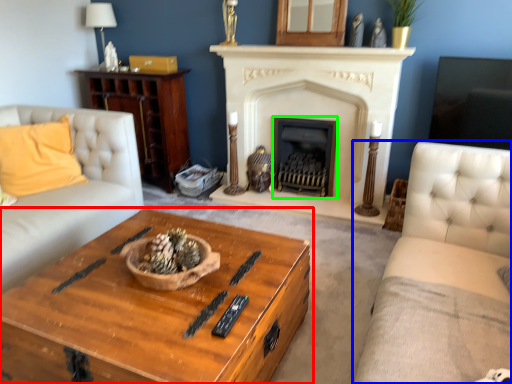
Question: Estimate the real-world distances between objects in this image. Which object is farther from coffee table (highlighted by a red box), studio couch (highlighted by a blue box) or fireplace (highlighted by a green box)?

Choices:
 (A) studio couch
 (B) fireplace

Answer: (B)